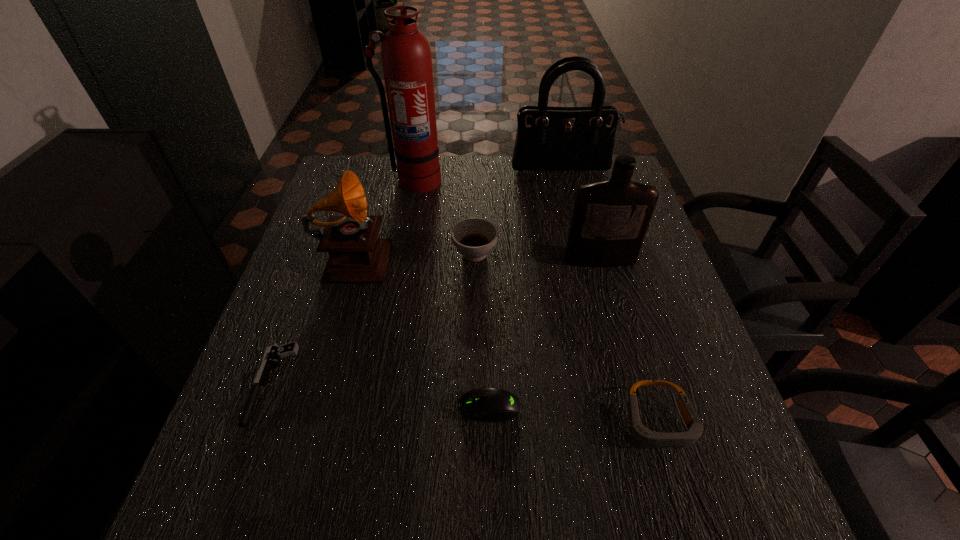
At what (x,y) coordinates should I click in order to perform the action: click on pistol located at the left edge. Please return your answer as a coordinate pair (x, y). The image size is (960, 540). Looking at the image, I should click on (273, 352).

Locate an element on the screen. This screenshot has width=960, height=540. handbag located at the right edge is located at coordinates (548, 138).

Where is `liquor that is positioned at the right edge`? The image size is (960, 540). liquor that is positioned at the right edge is located at coordinates (610, 219).

Identify the location of goggles at the right edge. This screenshot has height=540, width=960. (643, 436).

Find the location of a particular element. object situated at the far right corner is located at coordinates (548, 138).

What are the coordinates of `vacant space at the far edge` in the screenshot? It's located at (486, 155).

This screenshot has width=960, height=540. I want to click on vacant space at the near edge of the desktop, so click(592, 522).

I want to click on vacant space at the right edge of the desktop, so click(x=682, y=343).

Find the location of a particular element. This screenshot has width=960, height=540. vacant space at the far left corner of the desktop is located at coordinates (388, 161).

The image size is (960, 540). In order to click on vacant space at the near right corner in this screenshot , I will do `click(715, 476)`.